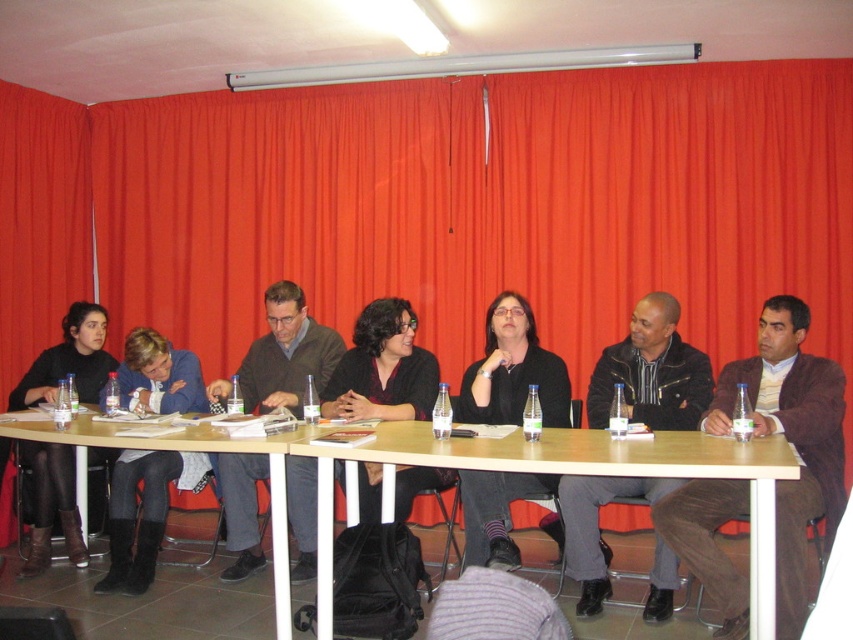
Based on the photo, does black matte shirt at center have a greater width compared to wooden table at center?

Incorrect, black matte shirt at center's width does not surpass wooden table at center's.

Does black matte shirt at center have a lesser width compared to wooden table at center?

Yes.

I want to click on black matte shirt at center, so click(x=514, y=371).

Which is in front, point (780, 454) or point (85, 506)?

Point (780, 454)

Does light brown wood table at center have a greater width compared to wooden table at center?

Yes, light brown wood table at center is wider than wooden table at center.

Does point (772, 632) come in front of point (178, 444)?

Yes, point (772, 632) is closer to viewer.

The width and height of the screenshot is (853, 640). I want to click on light brown wood table at center, so click(x=563, y=474).

How distant is matte brown sweater at center from black matte shirt at center?

The distance of matte brown sweater at center from black matte shirt at center is 36.03 inches.

Is matte brown sweater at center further to the viewer compared to black matte shirt at center?

Yes, it is behind black matte shirt at center.

Is point (263, 356) farther from camera compared to point (546, 476)?

Yes, it is behind point (546, 476).

The height and width of the screenshot is (640, 853). Identify the location of matte brown sweater at center. (287, 353).